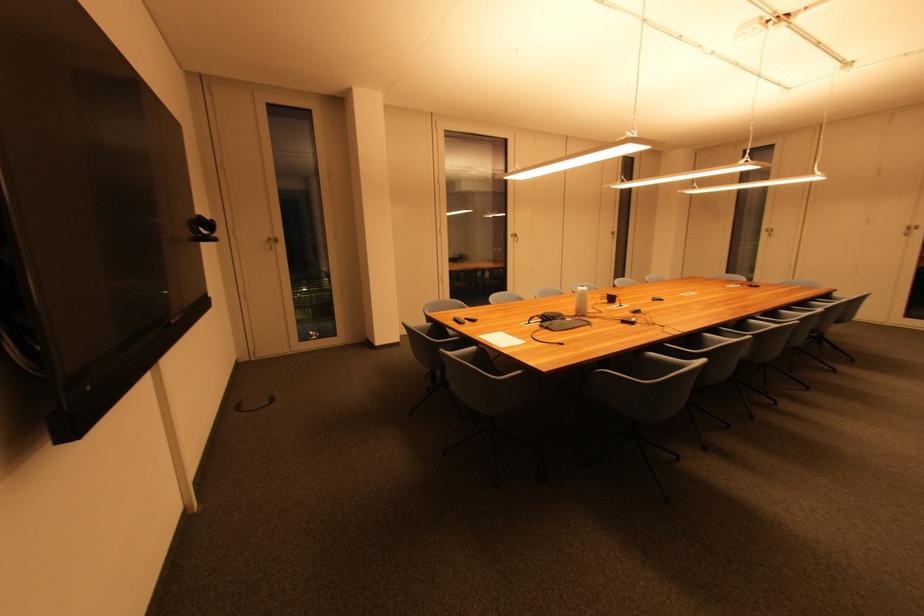
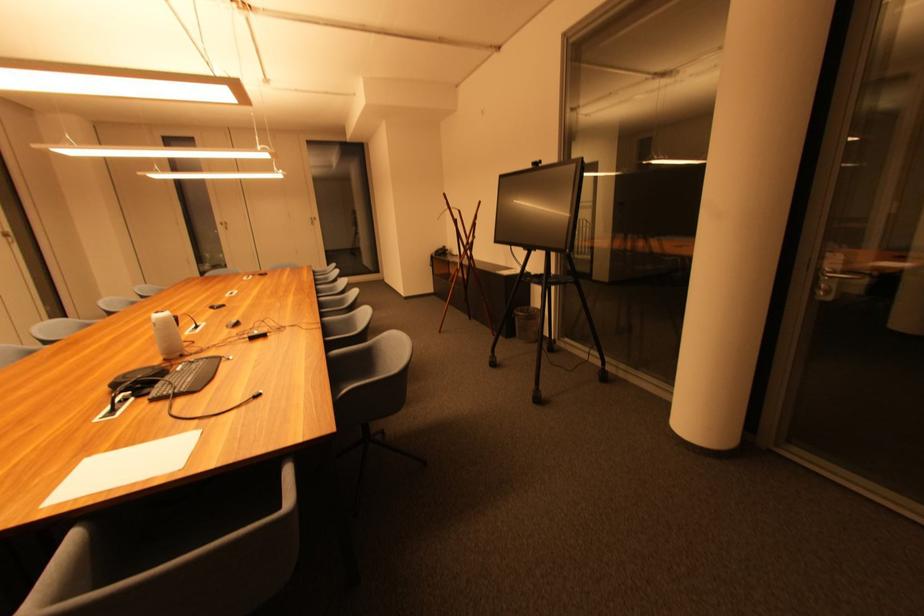
In the second image, find the point that corresponds to pixel 573 322 in the first image.

(184, 371)